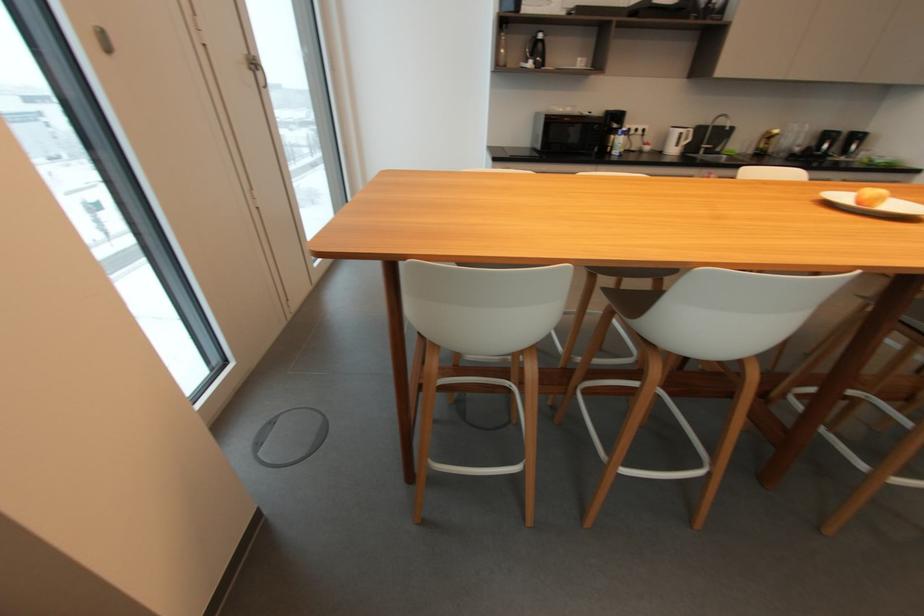
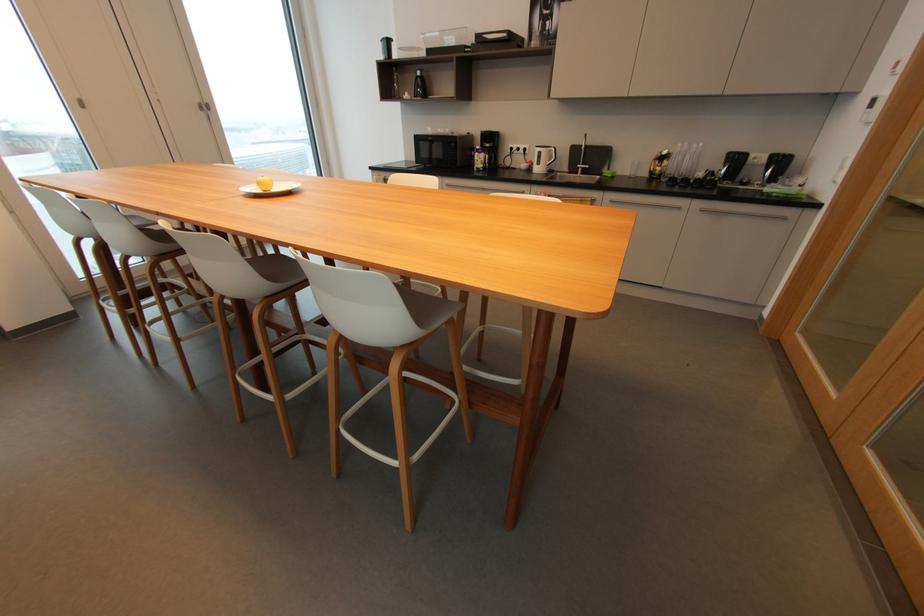
Find the pixel in the second image that matches pixel 775 140 in the first image.

(669, 161)